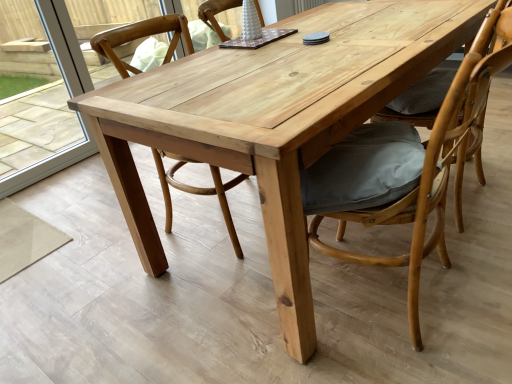
Question: Are matte gray cushion at right, the 3th chair viewed from the left, and transparent glass door at left located far from each other?

Choices:
 (A) no
 (B) yes

Answer: (B)

Question: Does matte gray cushion at right, arranged as the 1th chair when viewed from the right, have a greater height compared to transparent glass door at left?

Choices:
 (A) no
 (B) yes

Answer: (A)

Question: From the image's perspective, is matte gray cushion at right, the 3th chair viewed from the left, on top of transparent glass door at left?

Choices:
 (A) no
 (B) yes

Answer: (A)

Question: Is matte gray cushion at right, the 3th chair viewed from the left, located outside transparent glass door at left?

Choices:
 (A) yes
 (B) no

Answer: (A)

Question: Is matte gray cushion at right, arranged as the 1th chair when viewed from the right, in front of transparent glass door at left?

Choices:
 (A) yes
 (B) no

Answer: (A)

Question: Is matte gray cushion at right, the 3th chair viewed from the left, inside the boundaries of natural wood chair at center, which is counted as the 1th chair, starting from the left, or outside?

Choices:
 (A) outside
 (B) inside

Answer: (A)

Question: In the image, is matte gray cushion at right, the 3th chair viewed from the left, positioned in front of or behind natural wood chair at center, the 3th chair from the right?

Choices:
 (A) front
 (B) behind

Answer: (A)

Question: From a real-world perspective, is matte gray cushion at right, arranged as the 1th chair when viewed from the right, above or below natural wood chair at center, which is counted as the 1th chair, starting from the left?

Choices:
 (A) below
 (B) above

Answer: (B)

Question: In terms of height, does matte gray cushion at right, the 3th chair viewed from the left, look taller or shorter compared to natural wood chair at center, which is counted as the 1th chair, starting from the left?

Choices:
 (A) tall
 (B) short

Answer: (B)

Question: Considering their positions, is wooden cushioned chair at center, arranged as the 2th chair when viewed from the left, located in front of or behind natural wood chair at center, which is counted as the 1th chair, starting from the left?

Choices:
 (A) front
 (B) behind

Answer: (A)

Question: From a real-world perspective, is wooden cushioned chair at center, arranged as the 2th chair when viewed from the left, above or below natural wood chair at center, the 3th chair from the right?

Choices:
 (A) above
 (B) below

Answer: (B)

Question: Is point (437, 145) positioned closer to the camera than point (181, 29)?

Choices:
 (A) closer
 (B) farther

Answer: (A)

Question: Is wooden cushioned chair at center, which is the second chair in right-to-left order, bigger or smaller than natural wood chair at center, the 3th chair from the right?

Choices:
 (A) big
 (B) small

Answer: (A)

Question: Is matte gray cushion at right, arranged as the 1th chair when viewed from the right, to the left or to the right of wooden cushioned chair at center, arranged as the 2th chair when viewed from the left, in the image?

Choices:
 (A) left
 (B) right

Answer: (B)

Question: Looking at their shapes, would you say matte gray cushion at right, the 3th chair viewed from the left, is wider or thinner than wooden cushioned chair at center, arranged as the 2th chair when viewed from the left?

Choices:
 (A) wide
 (B) thin

Answer: (B)